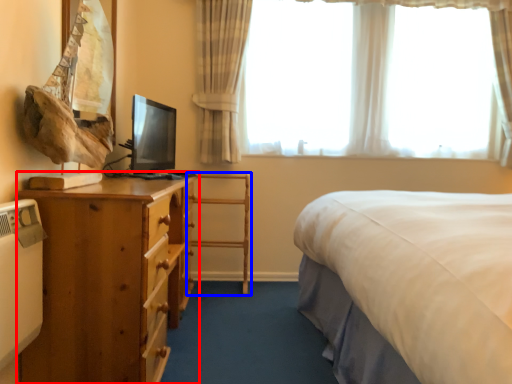
Question: Which object is closer to the camera taking this photo, nightstand (highlighted by a red box) or chair (highlighted by a blue box)?

Choices:
 (A) nightstand
 (B) chair

Answer: (A)